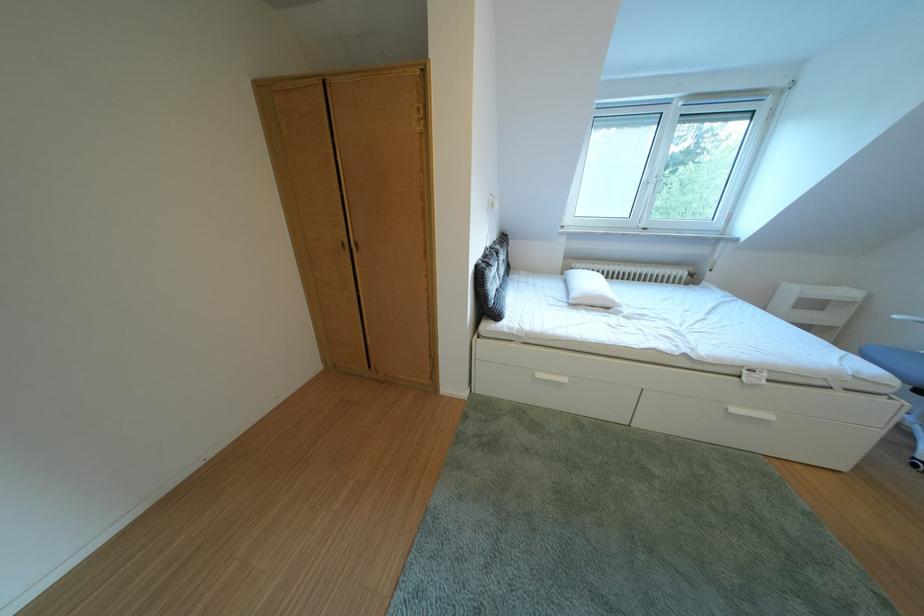
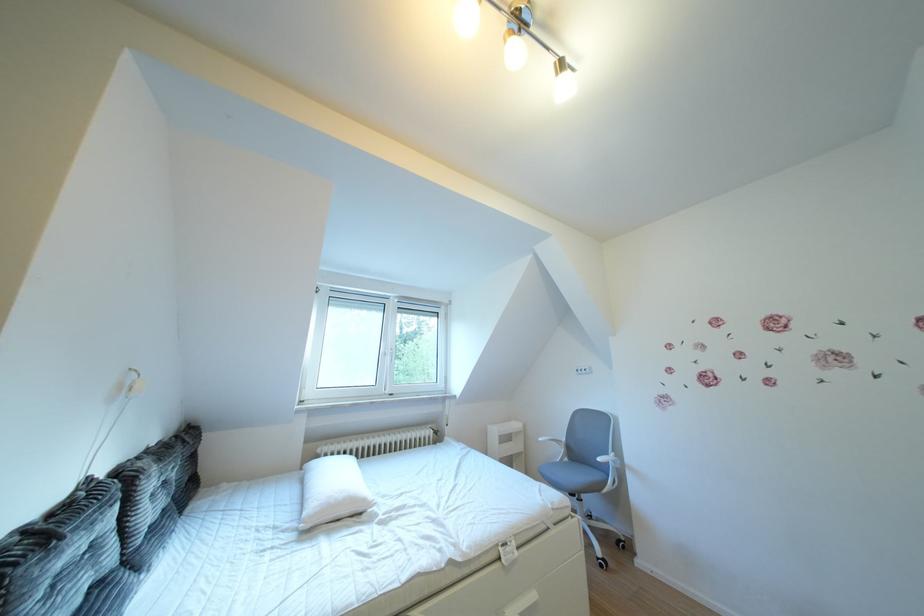
How did the camera likely rotate?

The rotation direction of the camera is right-up.